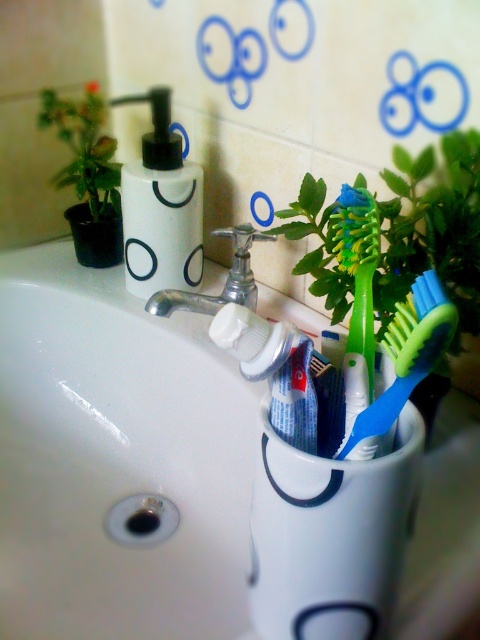
Can you confirm if white glossy sink at center is positioned to the left of green plastic toothbrush at center?

Indeed, white glossy sink at center is positioned on the left side of green plastic toothbrush at center.

Who is higher up, white glossy sink at center or green plastic toothbrush at center?

green plastic toothbrush at center is higher up.

Describe the element at coordinates (117, 458) in the screenshot. I see `white glossy sink at center` at that location.

You are a GUI agent. You are given a task and a screenshot of the screen. Output one action in this format:
    pyautogui.click(x=<x>, y=<y>)
    Task: Click on the white glossy sink at center
    The height and width of the screenshot is (640, 480).
    Given the screenshot: What is the action you would take?
    pyautogui.click(x=117, y=458)

Is green matte plant at upper right taller than white matte soap dispenser at upper left?

Incorrect, green matte plant at upper right's height is not larger of white matte soap dispenser at upper left's.

This screenshot has height=640, width=480. What are the coordinates of `green matte plant at upper right` in the screenshot? It's located at (434, 240).

Does white glossy sink at center appear on the right side of blue matte toothpaste at center?

Incorrect, white glossy sink at center is not on the right side of blue matte toothpaste at center.

Is white glossy sink at center taller than blue matte toothpaste at center?

Yes, white glossy sink at center is taller than blue matte toothpaste at center.

Describe the element at coordinates (117, 458) in the screenshot. I see `white glossy sink at center` at that location.

You are a GUI agent. You are given a task and a screenshot of the screen. Output one action in this format:
    pyautogui.click(x=<x>, y=<y>)
    Task: Click on the white glossy sink at center
    
    Given the screenshot: What is the action you would take?
    pyautogui.click(x=117, y=458)